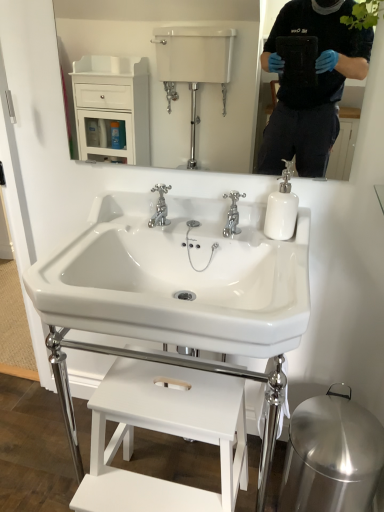
Question: Are white glossy sink at center and chrome metallic faucet at center far apart?

Choices:
 (A) yes
 (B) no

Answer: (B)

Question: Is white glossy sink at center positioned behind chrome metallic faucet at center?

Choices:
 (A) yes
 (B) no

Answer: (B)

Question: Considering the relative positions of white glossy sink at center and chrome metallic faucet at center in the image provided, is white glossy sink at center to the right of chrome metallic faucet at center from the viewer's perspective?

Choices:
 (A) no
 (B) yes

Answer: (A)

Question: From a real-world perspective, is white glossy sink at center physically below chrome metallic faucet at center?

Choices:
 (A) yes
 (B) no

Answer: (A)

Question: Is the position of white glossy sink at center less distant than that of chrome metallic faucet at center?

Choices:
 (A) no
 (B) yes

Answer: (B)

Question: Considering the positions of chrome metallic faucet at center and white glossy sink at center in the image, is chrome metallic faucet at center bigger or smaller than white glossy sink at center?

Choices:
 (A) big
 (B) small

Answer: (B)

Question: In the image, is chrome metallic faucet at center positioned in front of or behind white glossy sink at center?

Choices:
 (A) behind
 (B) front

Answer: (A)

Question: Considering the relative positions of chrome metallic faucet at center and white glossy sink at center in the image provided, is chrome metallic faucet at center to the left or to the right of white glossy sink at center?

Choices:
 (A) right
 (B) left

Answer: (A)

Question: From the image's perspective, relative to white glossy sink at center, is chrome metallic faucet at center above or below?

Choices:
 (A) below
 (B) above

Answer: (B)

Question: Considering the positions of white glossy mirror at upper center and chrome metallic faucet at center in the image, is white glossy mirror at upper center bigger or smaller than chrome metallic faucet at center?

Choices:
 (A) small
 (B) big

Answer: (B)

Question: Considering the positions of white glossy mirror at upper center and chrome metallic faucet at center in the image, is white glossy mirror at upper center wider or thinner than chrome metallic faucet at center?

Choices:
 (A) thin
 (B) wide

Answer: (A)

Question: Visually, is white glossy mirror at upper center positioned to the left or to the right of chrome metallic faucet at center?

Choices:
 (A) right
 (B) left

Answer: (B)

Question: Is white glossy mirror at upper center situated inside chrome metallic faucet at center or outside?

Choices:
 (A) inside
 (B) outside

Answer: (B)

Question: In terms of height, does white glossy soap dispenser at upper right look taller or shorter compared to white matte stool at lower center?

Choices:
 (A) short
 (B) tall

Answer: (A)

Question: In terms of size, does white glossy soap dispenser at upper right appear bigger or smaller than white matte stool at lower center?

Choices:
 (A) small
 (B) big

Answer: (A)